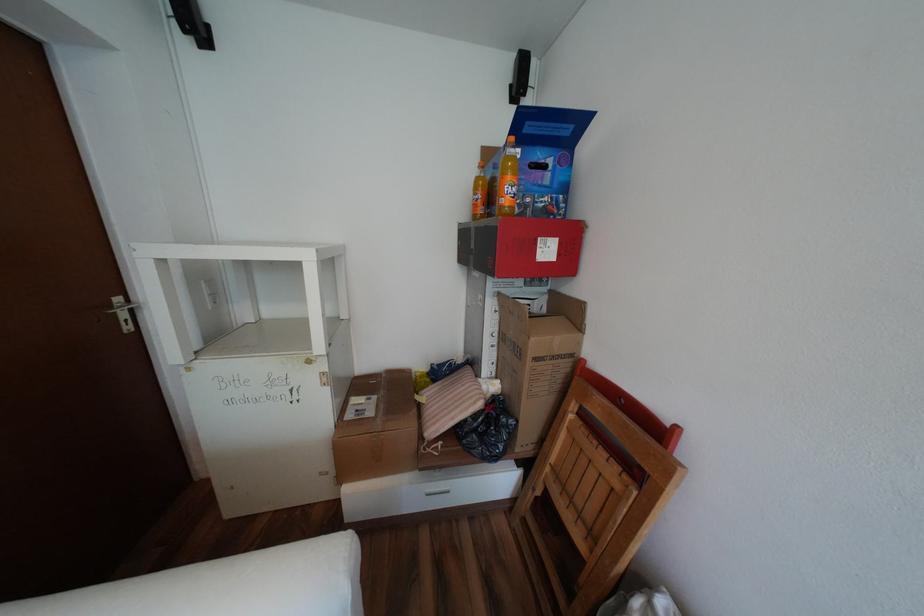
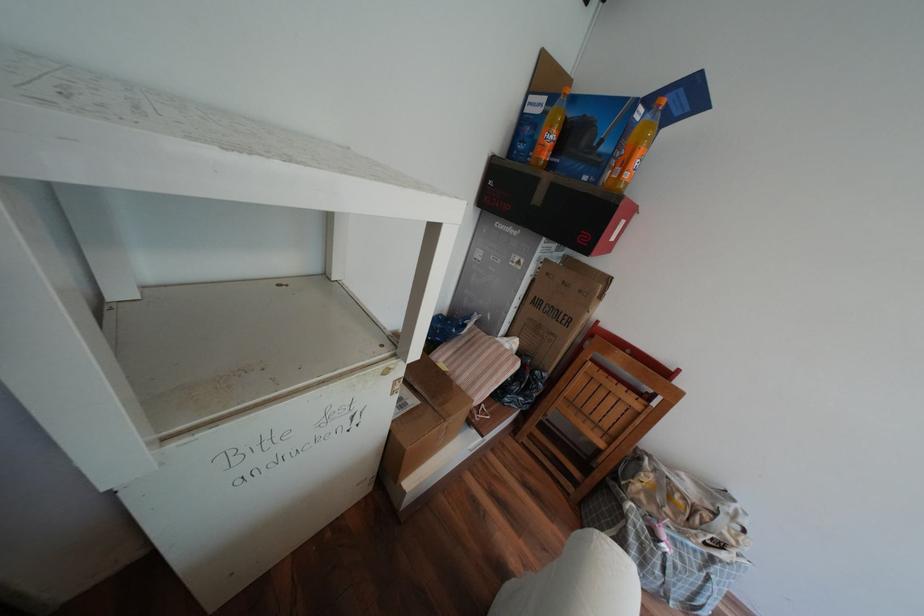
The point at (x=380, y=413) is marked in the first image. Where is the corresponding point in the second image?

(422, 400)